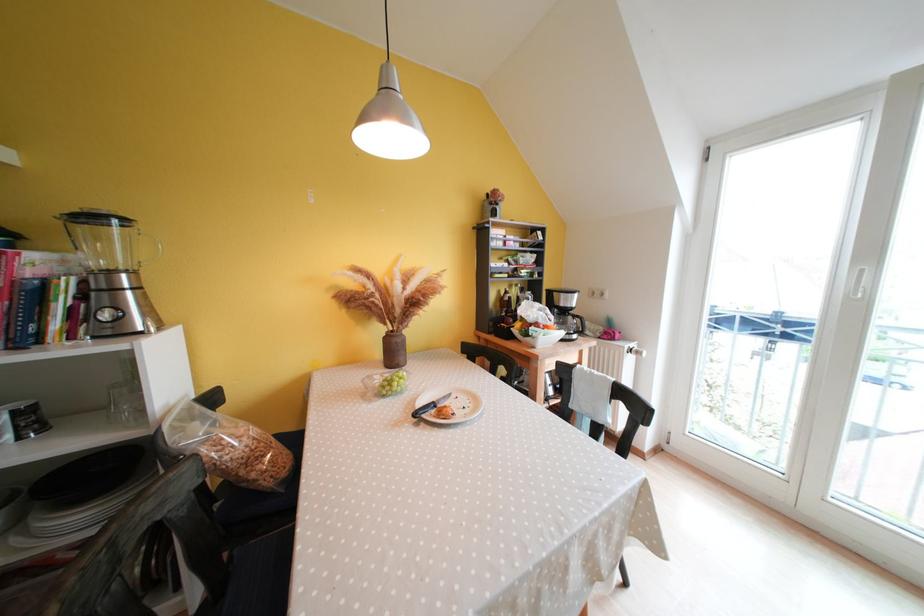
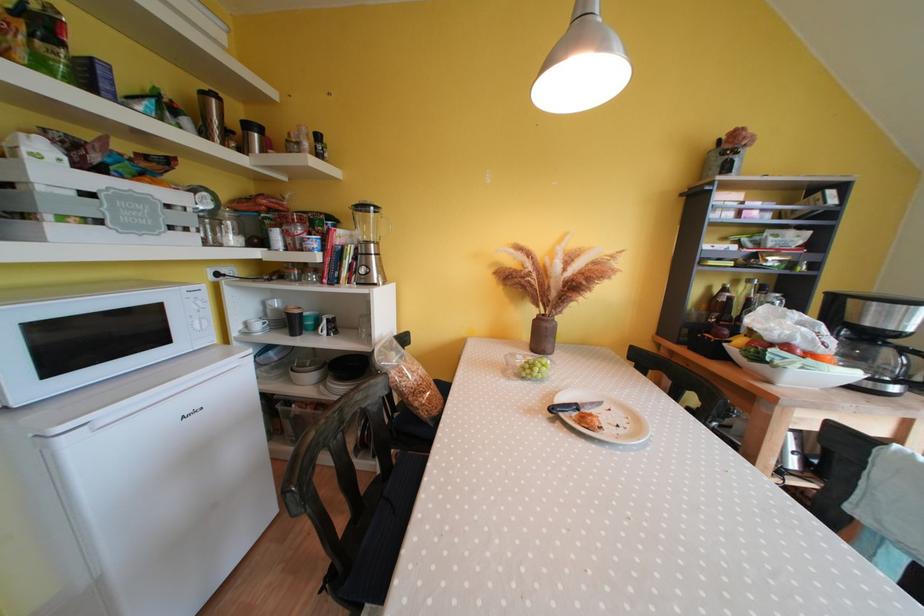
The point at (78, 313) is marked in the first image. Where is the corresponding point in the second image?

(357, 269)